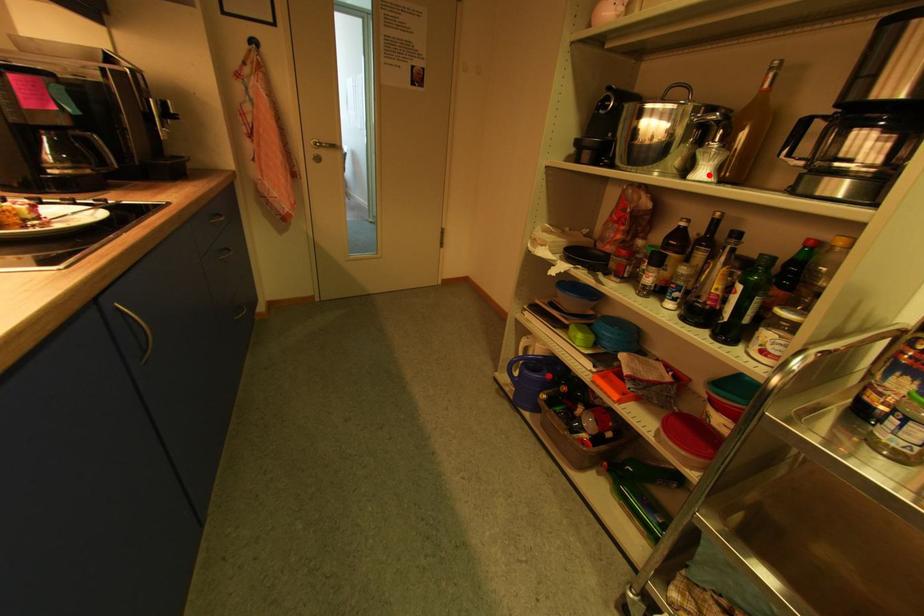
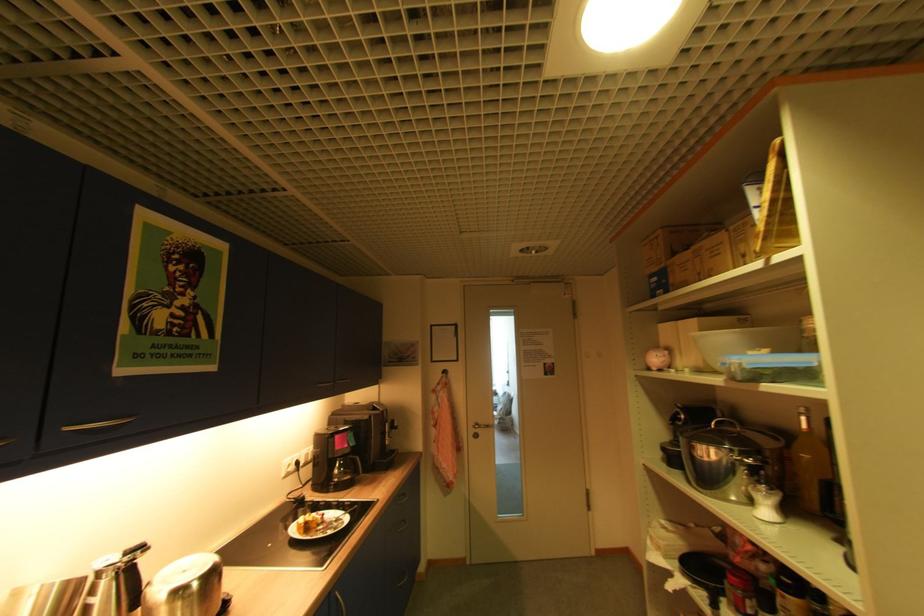
In the second image, find the point that corresponds to the highlighted location in the first image.

(772, 513)